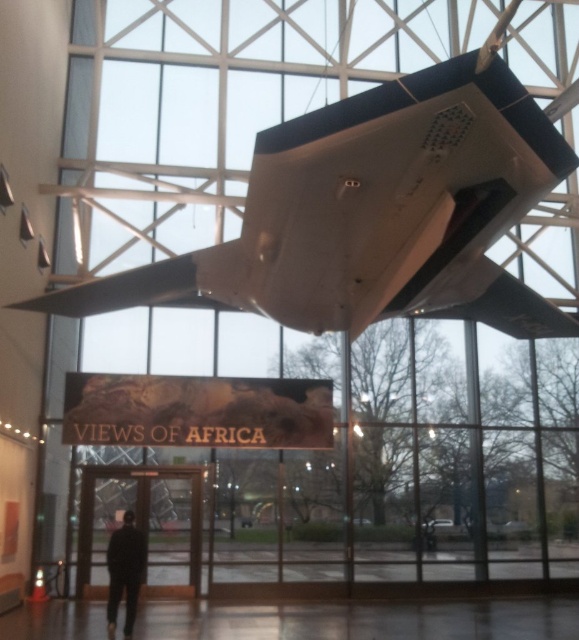
Does white matte airplane at upper center appear under black matte suit at lower left?

No, white matte airplane at upper center is not below black matte suit at lower left.

Is white matte airplane at upper center positioned before black matte suit at lower left?

Yes, white matte airplane at upper center is closer to the viewer.

Where is `white matte airplane at upper center`? The width and height of the screenshot is (579, 640). white matte airplane at upper center is located at coordinates (375, 211).

Identify the location of white matte airplane at upper center. The width and height of the screenshot is (579, 640). (375, 211).